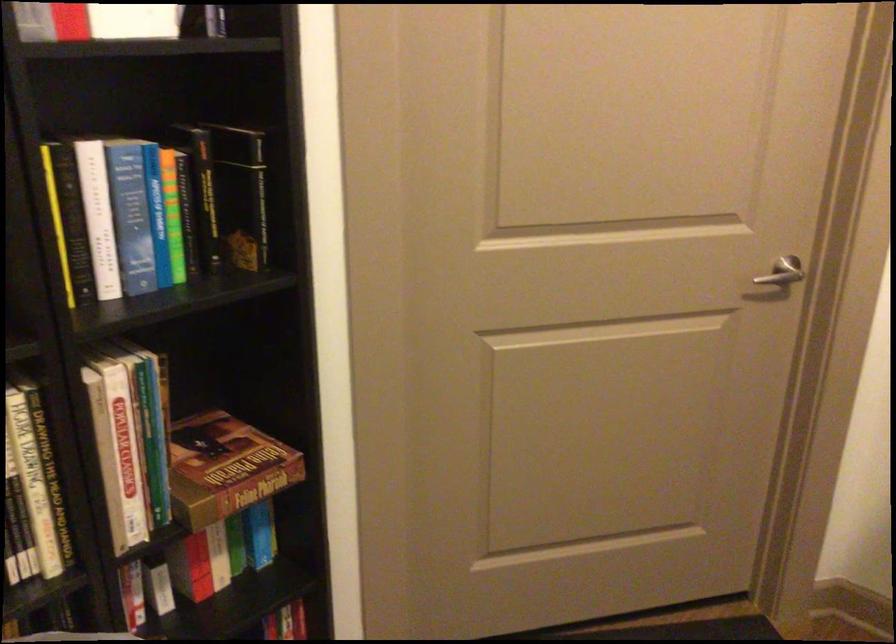
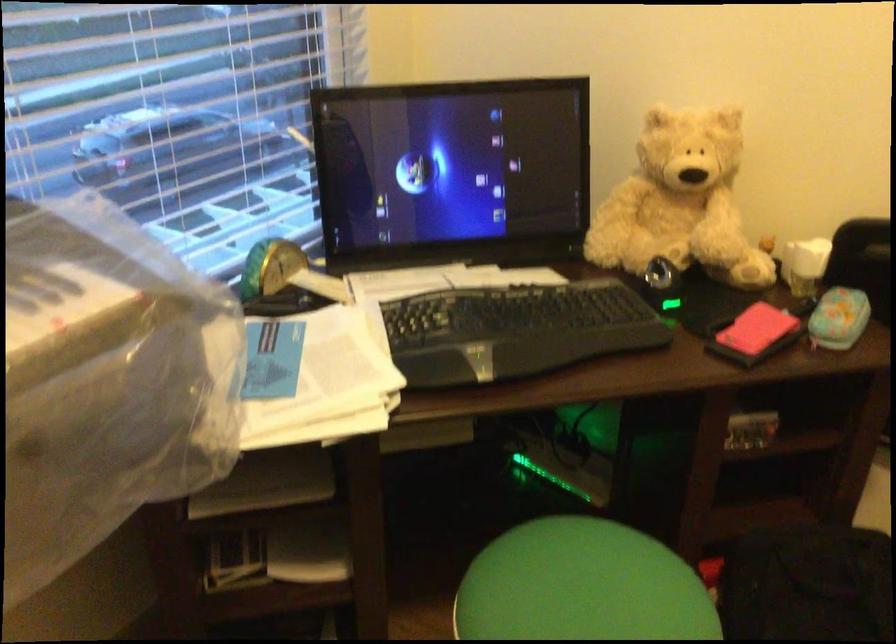
The first image is from the beginning of the video and the second image is from the end. How did the camera likely rotate when shooting the video?

The rotation direction of the camera is right-down.